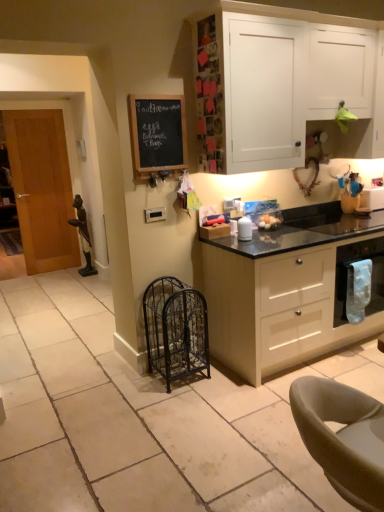
Where is `empty space that is ontop of black granite countertop at center (from a real-world perspective)`? empty space that is ontop of black granite countertop at center (from a real-world perspective) is located at coordinates (185, 425).